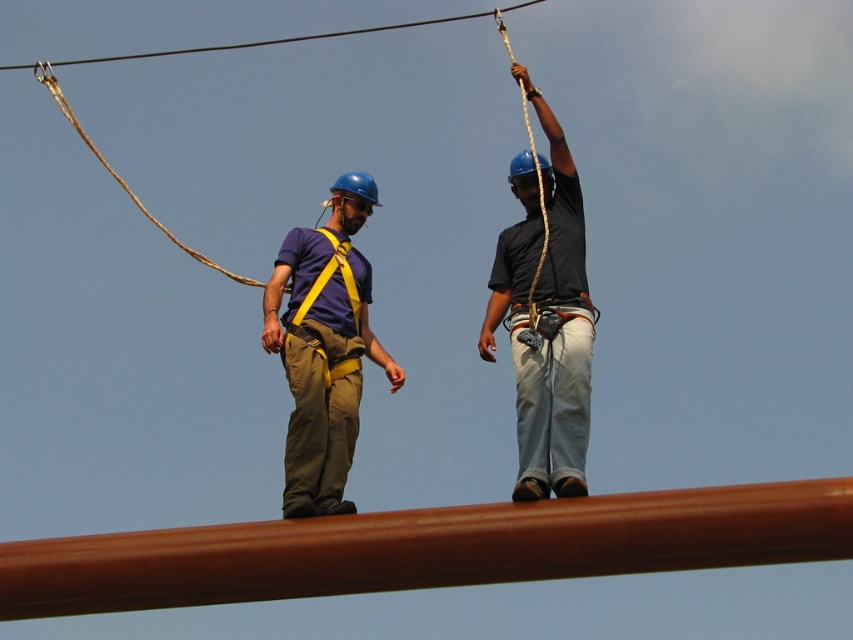
Question: Among these objects, which one is farthest from the camera?

Choices:
 (A) matte black shirt at upper right
 (B) matte yellow harness at center
 (C) black wire at upper center
 (D) brown polished pole at center

Answer: (C)

Question: Among these points, which one is nearest to the camera?

Choices:
 (A) (368, 205)
 (B) (355, 253)

Answer: (B)

Question: In this image, where is matte black shirt at upper right located relative to black wire at upper center?

Choices:
 (A) below
 (B) above

Answer: (A)

Question: Which of the following is the closest to the observer?

Choices:
 (A) matte black shirt at upper right
 (B) brown polished pole at center
 (C) black wire at upper center

Answer: (B)

Question: Does yellow fabric safety vest at center appear on the right side of black wire at upper center?

Choices:
 (A) no
 (B) yes

Answer: (B)

Question: Is matte yellow harness at center positioned before matte black shirt at upper right?

Choices:
 (A) no
 (B) yes

Answer: (A)